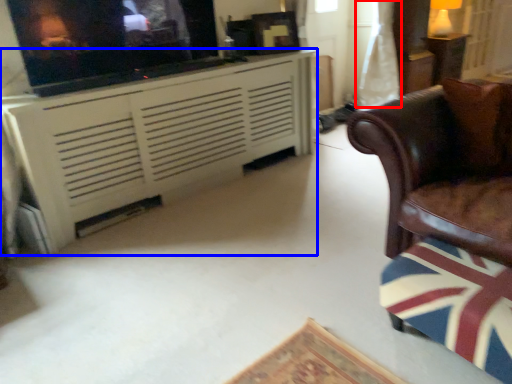
Question: Which of the following is the farthest to the observer, curtain (highlighted by a red box) or cabinetry (highlighted by a blue box)?

Choices:
 (A) curtain
 (B) cabinetry

Answer: (A)